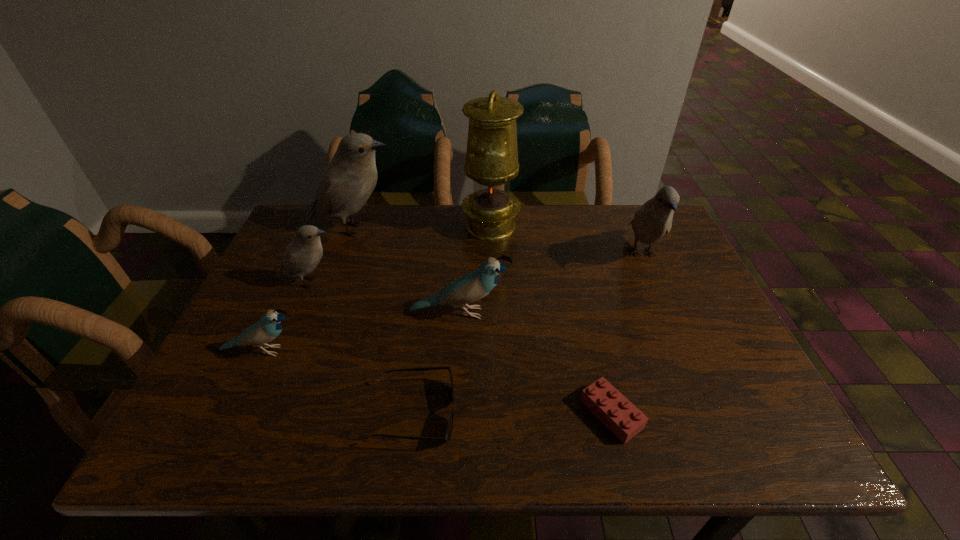
You are a GUI agent. You are given a task and a screenshot of the screen. Output one action in this format:
    pyautogui.click(x=<x>, y=<y>)
    Task: Click on the object that is the fifth closest to the sunglasses
    This screenshot has width=960, height=540.
    Given the screenshot: What is the action you would take?
    tap(492, 154)

Identify which object is the fifth closest to the tallest object. Please provide its 2D coordinates. Your answer should be formatted as a tuple, i.e. [(x, y)], where the tuple contains the x and y coordinates of a point satisfying the conditions above.

[(447, 436)]

Identify which bird is the closest to the second tallest bird. Please provide its 2D coordinates. Your answer should be formatted as a tuple, i.e. [(x, y)], where the tuple contains the x and y coordinates of a point satisfying the conditions above.

[(473, 286)]

Locate which bird is the closest to the rightmost bird. Please provide its 2D coordinates. Your answer should be formatted as a tuple, i.e. [(x, y)], where the tuple contains the x and y coordinates of a point satisfying the conditions above.

[(473, 286)]

Point out which white bird is positioned as the third nearest to the pink Lego. Please provide its 2D coordinates. Your answer should be formatted as a tuple, i.e. [(x, y)], where the tuple contains the x and y coordinates of a point satisfying the conditions above.

[(348, 181)]

Identify which white bird is the third closest to the sixth farthest object. Please provide its 2D coordinates. Your answer should be formatted as a tuple, i.e. [(x, y)], where the tuple contains the x and y coordinates of a point satisfying the conditions above.

[(654, 219)]

Where is `free space that satisfies the following two spatial constraints: 1. at the beak of the biggest white bird; 2. on the left side of the seventh object from left to right`? The height and width of the screenshot is (540, 960). free space that satisfies the following two spatial constraints: 1. at the beak of the biggest white bird; 2. on the left side of the seventh object from left to right is located at coordinates (287, 414).

Image resolution: width=960 pixels, height=540 pixels. What are the coordinates of `free spot that satisfies the following two spatial constraints: 1. on the front side of the tallest object; 2. on the lenses of the sunglasses` in the screenshot? It's located at (496, 413).

Locate an element on the screen. This screenshot has height=540, width=960. vacant area in the image that satisfies the following two spatial constraints: 1. at the beak of the smallest white bird; 2. on the left side of the second object from right to left is located at coordinates 254,414.

Image resolution: width=960 pixels, height=540 pixels. I want to click on free point that satisfies the following two spatial constraints: 1. at the face of the nearer blue bird; 2. on the right side of the second object from right to left, so click(x=232, y=414).